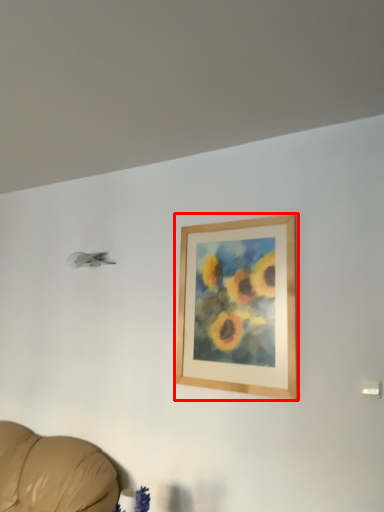
Question: From the image's perspective, where is picture frame (annotated by the red box) located relative to plant?

Choices:
 (A) above
 (B) below

Answer: (A)